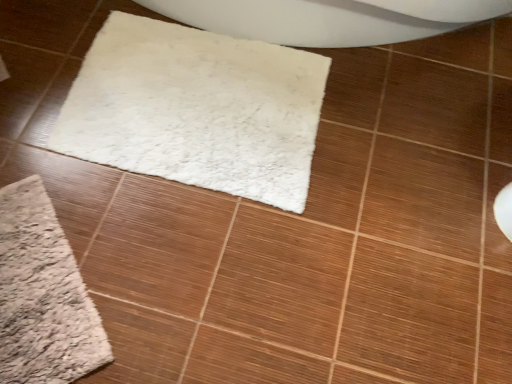
Question: Is beige fuzzy bath mat at lower left far from white fluffy mat at center?

Choices:
 (A) yes
 (B) no

Answer: (B)

Question: Does beige fuzzy bath mat at lower left have a lesser height compared to white fluffy mat at center?

Choices:
 (A) no
 (B) yes

Answer: (B)

Question: From a real-world perspective, does beige fuzzy bath mat at lower left sit lower than white fluffy mat at center?

Choices:
 (A) yes
 (B) no

Answer: (A)

Question: Is the position of beige fuzzy bath mat at lower left more distant than that of white fluffy mat at center?

Choices:
 (A) yes
 (B) no

Answer: (B)

Question: Does beige fuzzy bath mat at lower left come in front of white fluffy mat at center?

Choices:
 (A) yes
 (B) no

Answer: (A)

Question: Can you confirm if beige fuzzy bath mat at lower left is smaller than white fluffy mat at center?

Choices:
 (A) no
 (B) yes

Answer: (B)

Question: Is white fluffy mat at center bigger than beige fuzzy bath mat at lower left?

Choices:
 (A) yes
 (B) no

Answer: (A)

Question: Would you say white fluffy mat at center is outside beige fuzzy bath mat at lower left?

Choices:
 (A) no
 (B) yes

Answer: (B)

Question: Is white fluffy mat at center at the right side of beige fuzzy bath mat at lower left?

Choices:
 (A) yes
 (B) no

Answer: (A)

Question: From the image's perspective, is white fluffy mat at center below beige fuzzy bath mat at lower left?

Choices:
 (A) yes
 (B) no

Answer: (B)

Question: Does white fluffy mat at center appear on the left side of beige fuzzy bath mat at lower left?

Choices:
 (A) yes
 (B) no

Answer: (B)

Question: Is white fluffy mat at center positioned in front of beige fuzzy bath mat at lower left?

Choices:
 (A) yes
 (B) no

Answer: (B)

Question: In terms of height, does beige fuzzy bath mat at lower left look taller or shorter compared to white fluffy mat at center?

Choices:
 (A) tall
 (B) short

Answer: (B)